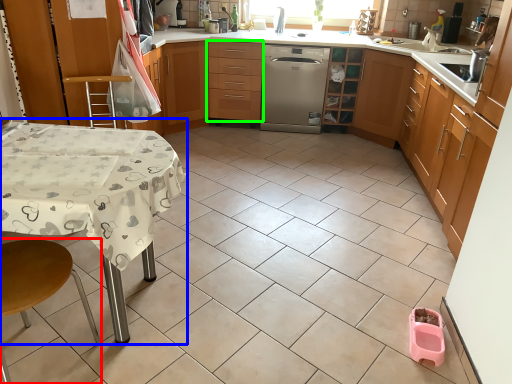
Question: Which object is positioned farthest from step stool (highlighted by a red box)? Select from table (highlighted by a blue box) and drawer (highlighted by a green box).

Choices:
 (A) table
 (B) drawer

Answer: (B)